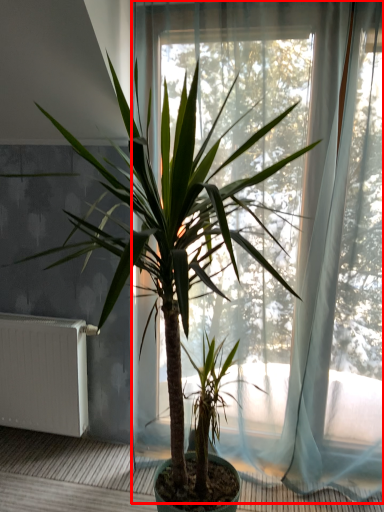
Question: From the image's perspective, where is window (annotated by the red box) located relative to radiator?

Choices:
 (A) below
 (B) above

Answer: (B)